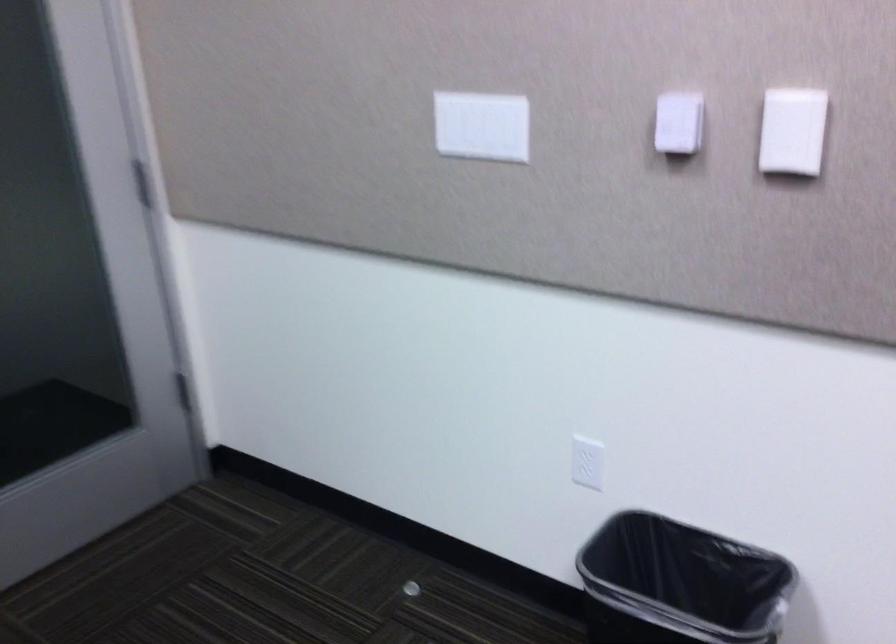
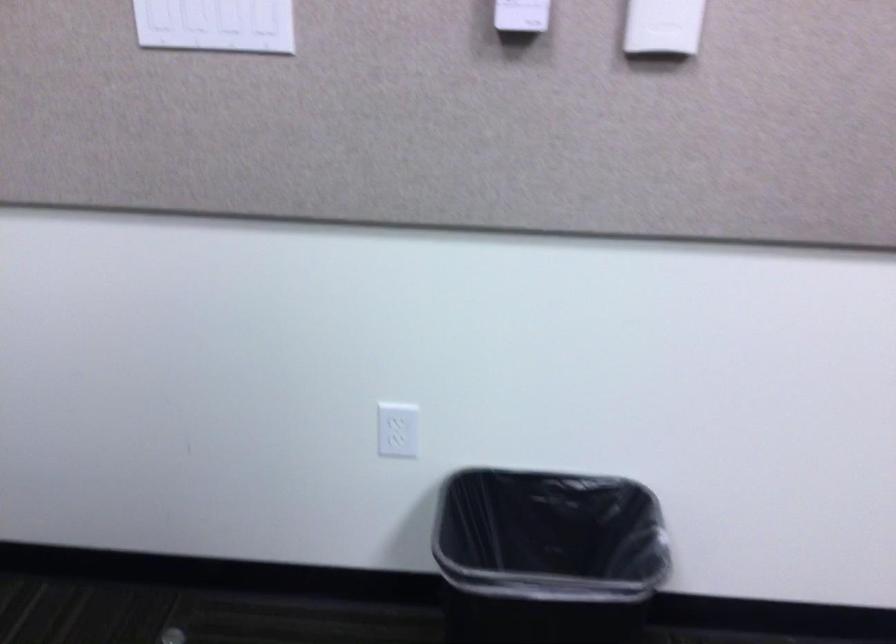
Locate, in the second image, the point that corresponds to the point at 587,460 in the first image.

(398, 430)